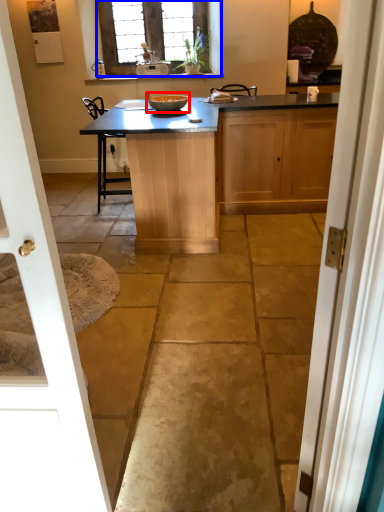
Question: Which object appears closest to the camera in this image, glass bowl (highlighted by a red box) or window (highlighted by a blue box)?

Choices:
 (A) glass bowl
 (B) window

Answer: (A)